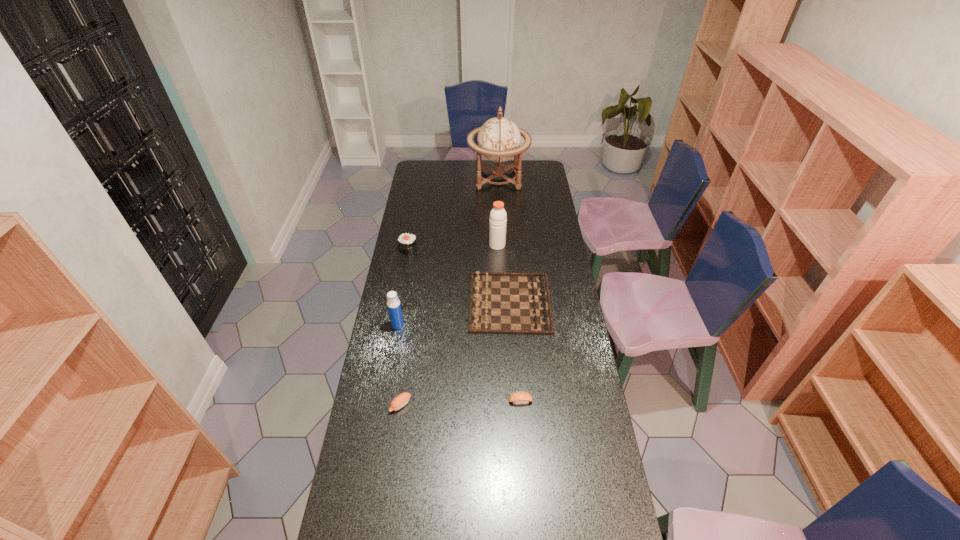
Find the location of a particular element. globe present at the right edge is located at coordinates tap(498, 139).

The width and height of the screenshot is (960, 540). Find the location of `chessboard present at the right edge`. chessboard present at the right edge is located at coordinates (500, 303).

The height and width of the screenshot is (540, 960). In order to click on object located in the far right corner section of the desktop in this screenshot , I will do `click(498, 139)`.

Identify the location of vacant space at the left edge of the desktop. This screenshot has height=540, width=960. (419, 292).

Identify the location of vacant space at the right edge of the desktop. (542, 238).

Identify the location of vacant area at the far left corner of the desktop. (436, 174).

Find the location of a particular element. The image size is (960, 540). free space between the third tallest object and the chessboard is located at coordinates (454, 314).

This screenshot has width=960, height=540. I want to click on blank region between the chessboard and the shortest sushi, so click(x=516, y=352).

The height and width of the screenshot is (540, 960). Identify the location of vacant space that is in between the second tallest object and the sixth tallest object. pos(449,325).

Locate an element on the screen. empty space that is in between the second tallest sushi and the chessboard is located at coordinates (455, 354).